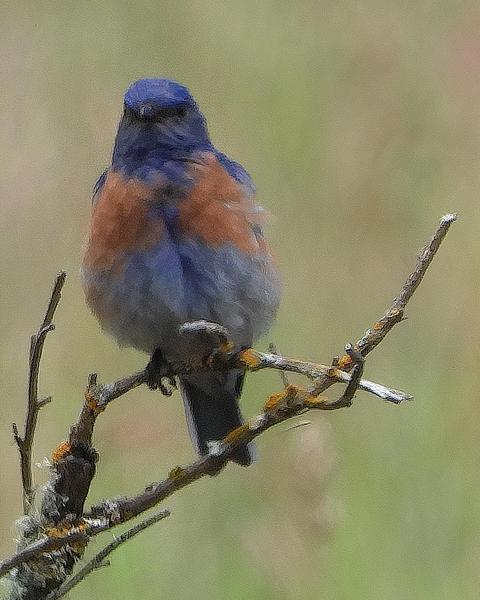
In order to click on bird oil painting in this screenshot , I will do `click(175, 272)`.